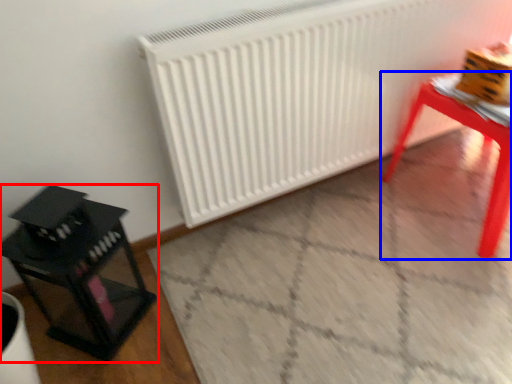
Question: Which point is closer to the camera, furniture (highlighted by a red box) or table (highlighted by a blue box)?

Choices:
 (A) furniture
 (B) table

Answer: (A)